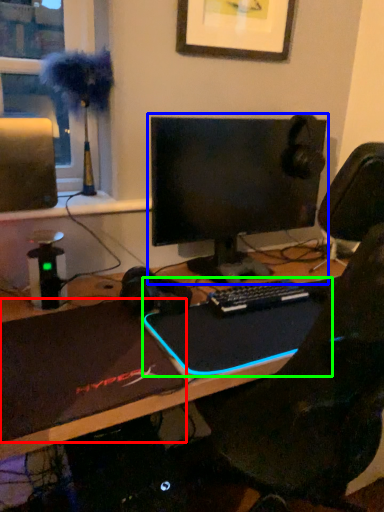
Question: Based on their relative distances, which object is nearer to laptop (highlighted by a red box)? Choose from computer monitor (highlighted by a blue box) and laptop (highlighted by a green box).

Choices:
 (A) computer monitor
 (B) laptop

Answer: (B)